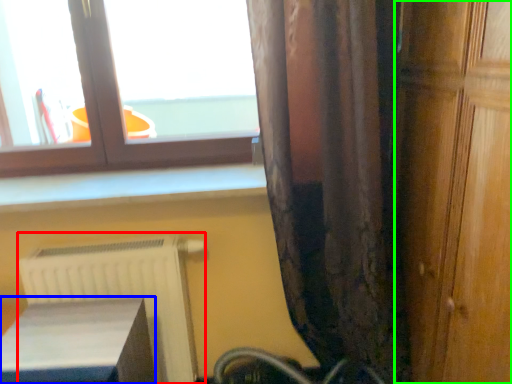
Question: Considering the real-world distances, which object is closest to radiator (highlighted by a red box)? furniture (highlighted by a blue box) or door (highlighted by a green box).

Choices:
 (A) furniture
 (B) door

Answer: (A)